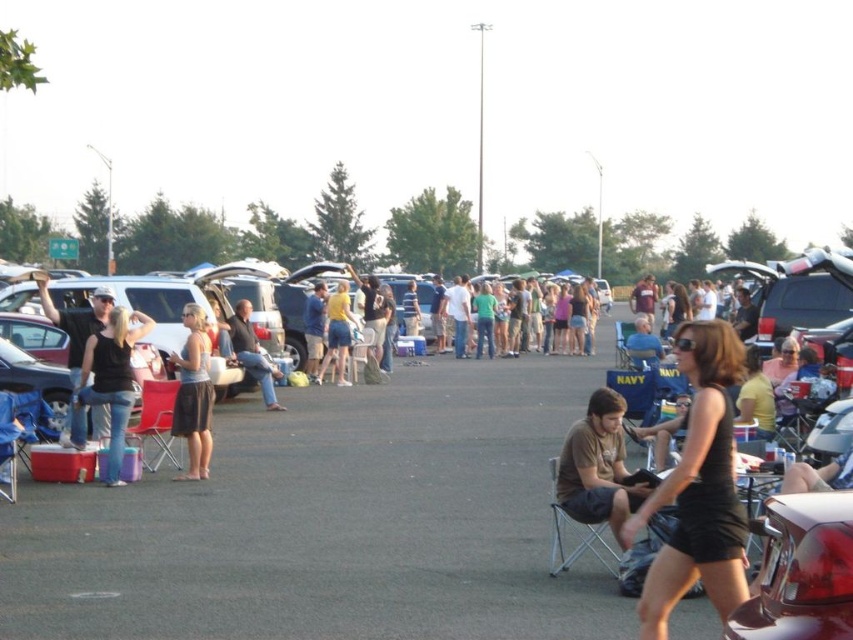
You are at a tailgate party and see both the denim skirt at center and the blue denim shorts at center. Which one is closer to you?

The denim skirt at center is closer to you because it is in front of the blue denim shorts at center.

You are planning to park your car in the parking lot and need to know if the space between two existing cars is wide enough for your car. You see a matte black car at center and a matte black folding chair at center. Which object should you compare the width of your car to determine if it fits?

You should compare the width of your car to the matte black car at center because it is wider than the matte black folding chair at center, so if your car is narrower than the matte black car at center, it should fit in the space.

You are a photographer at the event and want to capture a photo of the shiny red tail light at lower right without the denim skirt at center blocking it. How should you adjust your camera angle?

To avoid the denim skirt at center blocking the shiny red tail light at lower right, you should angle your camera downward since the shiny red tail light at lower right is positioned under the denim skirt at center.